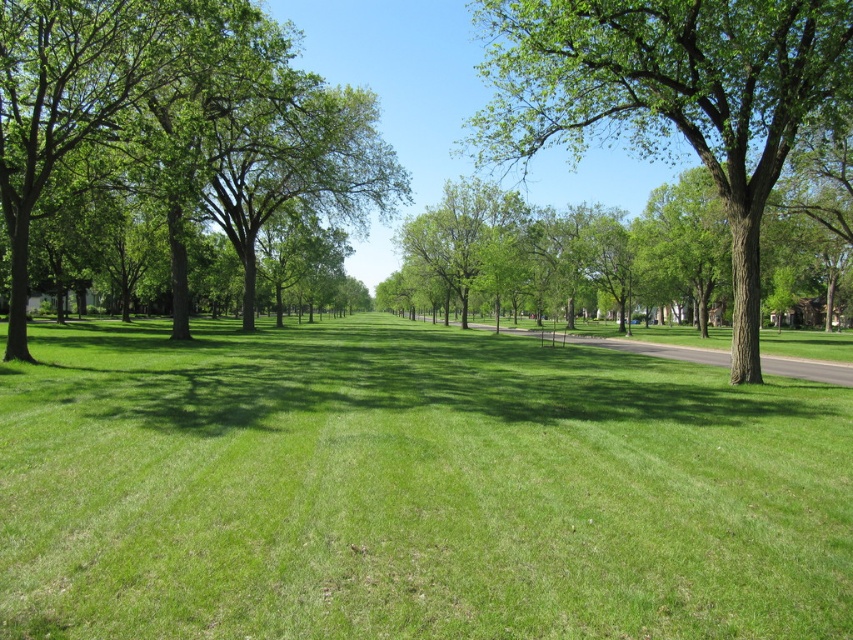
Is green grassy field at center further to camera compared to green rough bark tree at center?

That is False.

Is point (759, 536) farther from camera compared to point (683, 104)?

No, (759, 536) is in front of (683, 104).

What are the coordinates of `green grassy field at center` in the screenshot? It's located at (410, 488).

Is point (61, 467) farther from camera compared to point (54, 148)?

No, (61, 467) is in front of (54, 148).

Does green grassy field at center lie behind green leafy tree at left?

No, it is in front of green leafy tree at left.

Find the location of a particular element. Image resolution: width=853 pixels, height=640 pixels. green grassy field at center is located at coordinates (410, 488).

Looking at this image, is green rough bark tree at center positioned before green leafy tree at left?

Yes, it is.

Between green rough bark tree at center and green leafy tree at left, which one is positioned higher?

green rough bark tree at center is higher up.

Is point (723, 77) closer to camera compared to point (77, 26)?

Yes, point (723, 77) is in front of point (77, 26).

The height and width of the screenshot is (640, 853). Find the location of `green rough bark tree at center`. green rough bark tree at center is located at coordinates (668, 97).